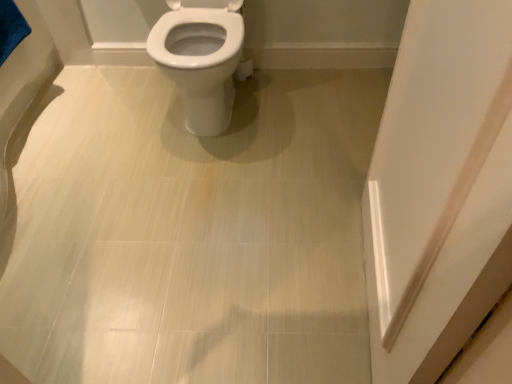
Describe the element at coordinates (200, 62) in the screenshot. I see `white glossy toilet at center` at that location.

In order to face white glossy toilet at center, should I rotate leftwards or rightwards?

You should rotate left by 7.103 degrees.

Find the location of a particular element. This screenshot has width=512, height=384. white glossy toilet at center is located at coordinates (200, 62).

Measure the distance between point (221, 55) and camera.

4.99 feet.

This screenshot has width=512, height=384. What are the coordinates of `white glossy toilet at center` in the screenshot? It's located at (200, 62).